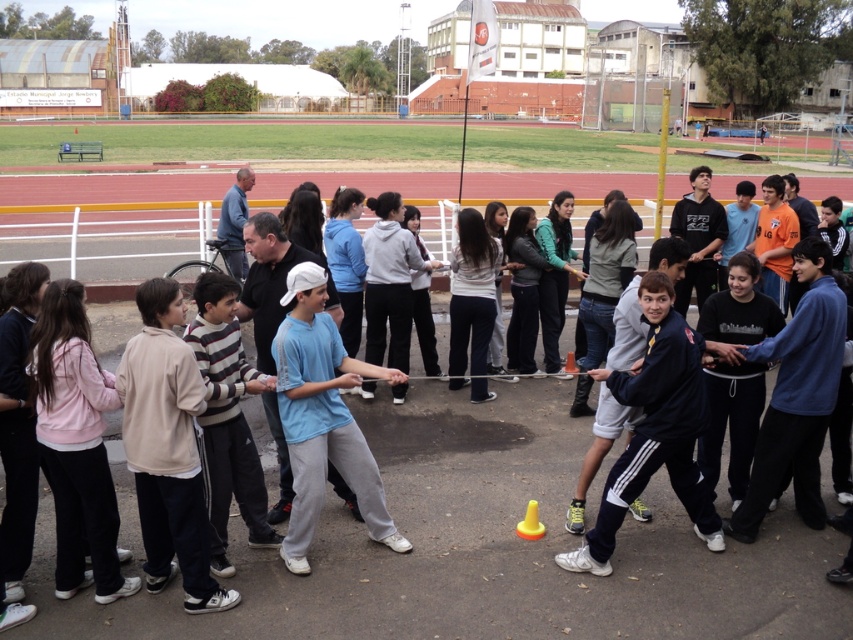
In the scene shown: Does light blue t-shirt at center have a lesser height compared to navy blue sweatshirt at center?

Incorrect, light blue t-shirt at center's height does not fall short of navy blue sweatshirt at center's.

Between point (396, 536) and point (660, 349), which one is positioned in front?

Point (660, 349) is in front.

What do you see at coordinates (323, 417) in the screenshot? This screenshot has height=640, width=853. I see `light blue t-shirt at center` at bounding box center [323, 417].

Where is `light blue t-shirt at center`? light blue t-shirt at center is located at coordinates (323, 417).